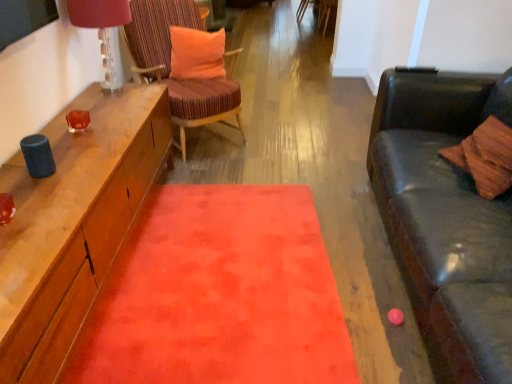
Question: From a real-world perspective, is matte glass lampshade at upper left under orange plush pillow at center?

Choices:
 (A) yes
 (B) no

Answer: (B)

Question: Does matte glass lampshade at upper left come in front of orange plush pillow at center?

Choices:
 (A) no
 (B) yes

Answer: (B)

Question: Would you consider matte glass lampshade at upper left to be distant from orange plush pillow at center?

Choices:
 (A) yes
 (B) no

Answer: (B)

Question: Is matte glass lampshade at upper left bigger than orange plush pillow at center?

Choices:
 (A) no
 (B) yes

Answer: (B)

Question: From the image's perspective, is matte glass lampshade at upper left above orange plush pillow at center?

Choices:
 (A) yes
 (B) no

Answer: (B)

Question: In terms of height, does velvet orange rug at center look taller or shorter compared to orange plush pillow at center?

Choices:
 (A) tall
 (B) short

Answer: (B)

Question: From a real-world perspective, is velvet orange rug at center above or below orange plush pillow at center?

Choices:
 (A) above
 (B) below

Answer: (B)

Question: Would you say velvet orange rug at center is to the left or to the right of orange plush pillow at center in the picture?

Choices:
 (A) right
 (B) left

Answer: (A)

Question: Is velvet orange rug at center situated inside orange plush pillow at center or outside?

Choices:
 (A) inside
 (B) outside

Answer: (B)

Question: Considering the positions of matte glass lampshade at upper left and orange plush pillow at center in the image, is matte glass lampshade at upper left taller or shorter than orange plush pillow at center?

Choices:
 (A) short
 (B) tall

Answer: (B)

Question: Considering the positions of matte glass lampshade at upper left and orange plush pillow at center in the image, is matte glass lampshade at upper left wider or thinner than orange plush pillow at center?

Choices:
 (A) wide
 (B) thin

Answer: (A)

Question: From a real-world perspective, is matte glass lampshade at upper left positioned above or below orange plush pillow at center?

Choices:
 (A) below
 (B) above

Answer: (B)

Question: Visually, is matte glass lampshade at upper left positioned to the left or to the right of orange plush pillow at center?

Choices:
 (A) right
 (B) left

Answer: (B)

Question: Is velvet orange rug at center situated inside matte glass lampshade at upper left or outside?

Choices:
 (A) outside
 (B) inside

Answer: (A)

Question: From the image's perspective, relative to matte glass lampshade at upper left, is velvet orange rug at center above or below?

Choices:
 (A) above
 (B) below

Answer: (B)